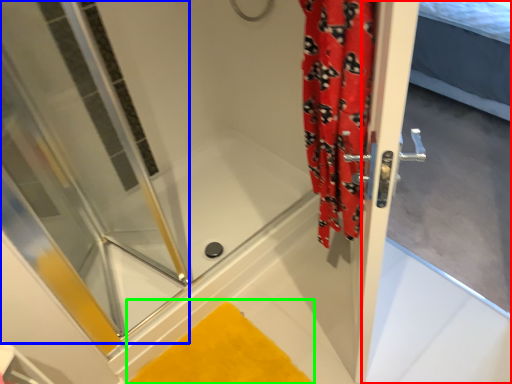
Question: Based on their relative distances, which object is nearer to screen door (highlighted by a red box)? Choose from shower door (highlighted by a blue box) and bath mat (highlighted by a green box).

Choices:
 (A) shower door
 (B) bath mat

Answer: (B)